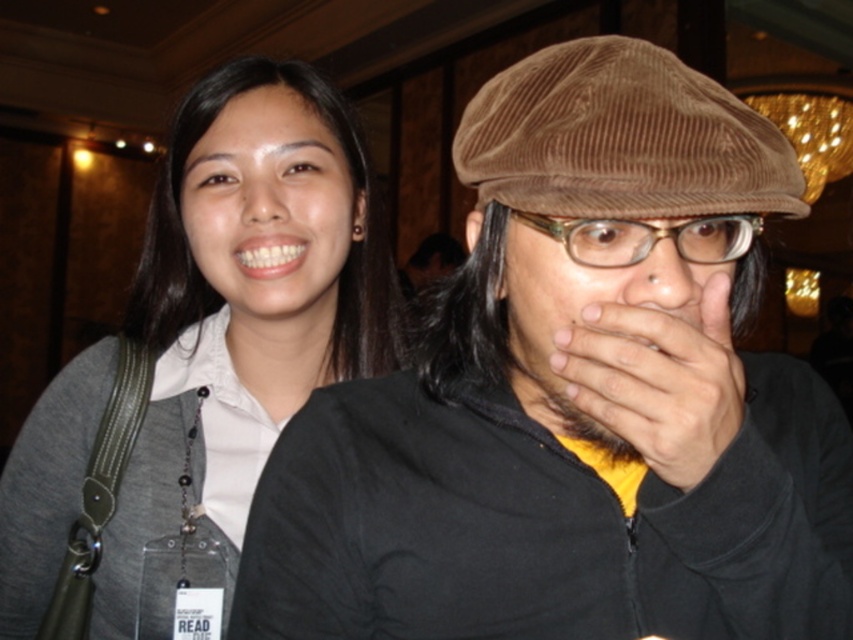
Question: Is brown corduroy cap at upper center closer to the viewer compared to dark skin/hair at center?

Choices:
 (A) no
 (B) yes

Answer: (B)

Question: Can you confirm if gray fabric shirt at left is wider than dark skin/hair at center?

Choices:
 (A) yes
 (B) no

Answer: (A)

Question: Among these points, which one is farthest from the camera?

Choices:
 (A) (735, 218)
 (B) (718, 321)

Answer: (A)

Question: Does gray fabric shirt at left appear under dark skin/hair at center?

Choices:
 (A) yes
 (B) no

Answer: (A)

Question: Which point is closer to the camera?

Choices:
 (A) (654, 442)
 (B) (258, 216)
 (C) (380, 528)
 (D) (631, 154)

Answer: (A)

Question: Which point is farther to the camera?

Choices:
 (A) (721, 260)
 (B) (622, 77)
 (C) (721, 352)

Answer: (A)